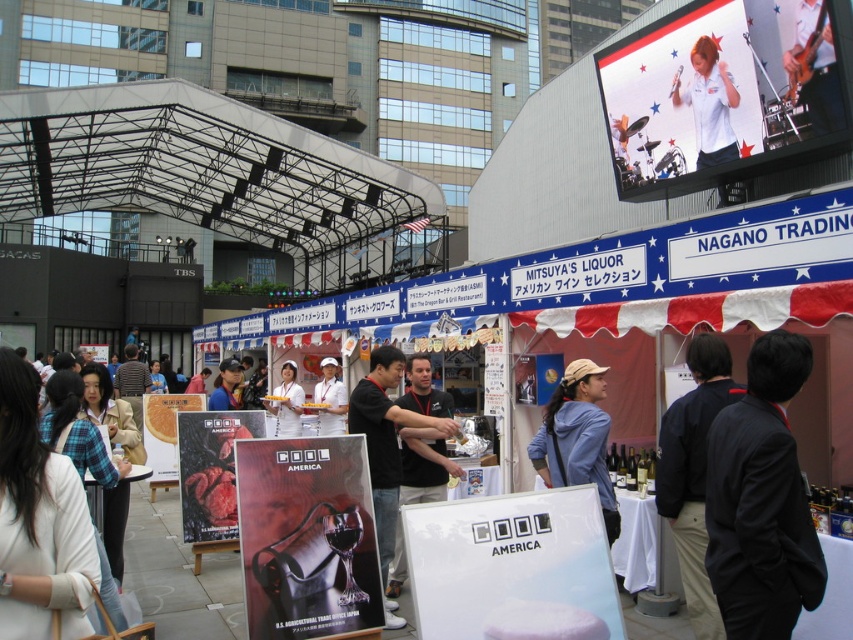
Is dark blue suit at center behind dark blue fabric jacket at right?

No, dark blue suit at center is closer to the viewer.

Is point (793, 465) positioned before point (692, 364)?

Yes, point (793, 465) is closer to viewer.

Is point (799, 563) positioned in front of point (664, 486)?

Yes.

This screenshot has height=640, width=853. I want to click on dark blue suit at center, so click(x=761, y=500).

Does dark blue suit at center appear on the left side of wooden signboard at center?

Incorrect, dark blue suit at center is not on the left side of wooden signboard at center.

Does point (717, 432) come in front of point (364, 465)?

That is True.

I want to click on dark blue suit at center, so click(761, 500).

Between wooden signboard at center and matte white shirt at upper right, which one is positioned lower?

wooden signboard at center is lower down.

Is point (335, 580) positioned in front of point (822, 1)?

Yes.

This screenshot has height=640, width=853. I want to click on wooden signboard at center, so click(306, 538).

This screenshot has height=640, width=853. What are the coordinates of `wooden signboard at center` in the screenshot? It's located at (306, 538).